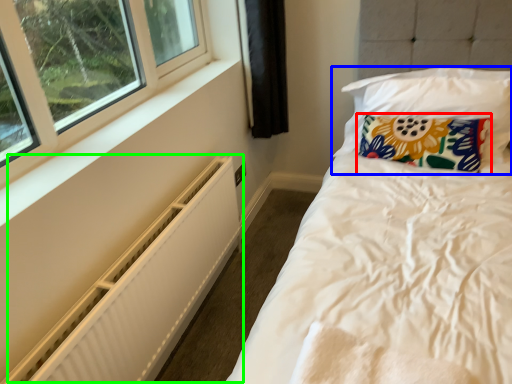
Question: Which is nearer to the pillow (highlighted by a red box)? pillow (highlighted by a blue box) or radiator (highlighted by a green box).

Choices:
 (A) pillow
 (B) radiator

Answer: (A)